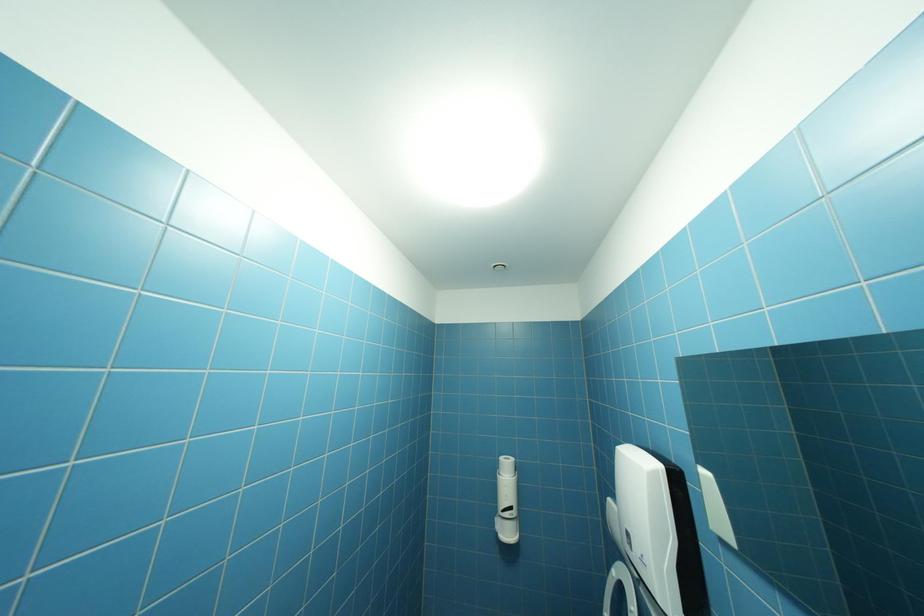
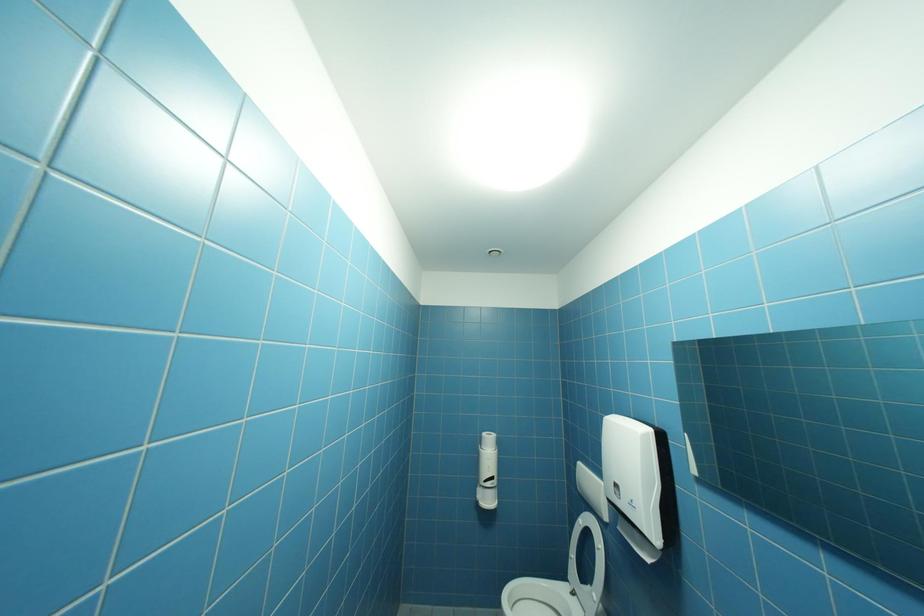
Question: How did the camera likely rotate?

Choices:
 (A) Left
 (B) Right
 (C) Up
 (D) Down

Answer: (B)